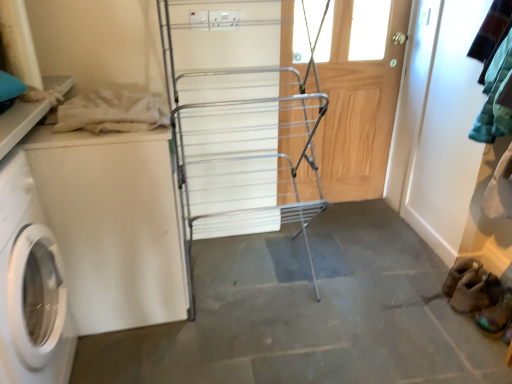
Where is `empty space that is in between silver metallic drying rack at center and brown suede shoe at lower right, the 1th shoe in the front-to-back sequence`? empty space that is in between silver metallic drying rack at center and brown suede shoe at lower right, the 1th shoe in the front-to-back sequence is located at coordinates (366, 306).